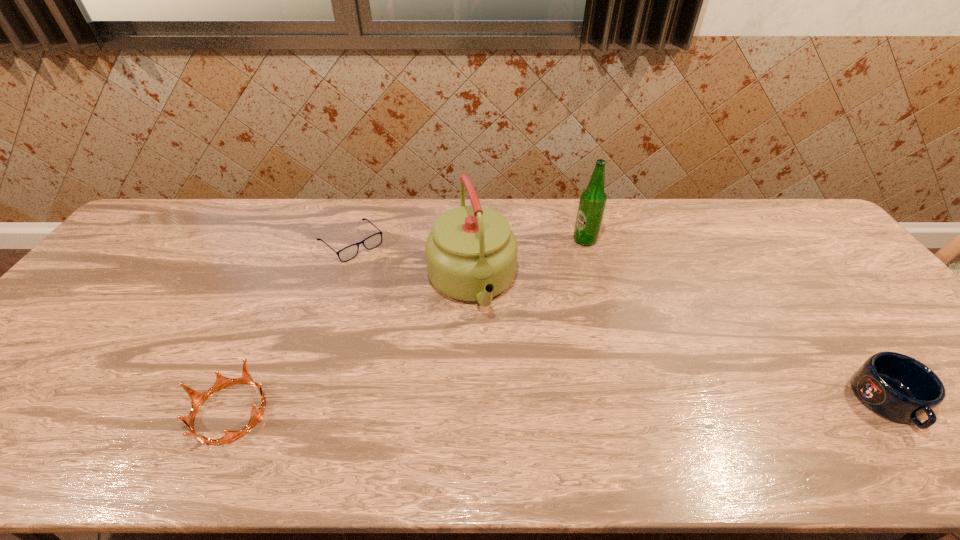
Where is `free spot located on the front-facing side of the shortest object`? free spot located on the front-facing side of the shortest object is located at coordinates pyautogui.click(x=410, y=299).

What are the coordinates of `vacant region located on the front-facing side of the shortest object` in the screenshot? It's located at (392, 282).

The width and height of the screenshot is (960, 540). In order to click on vacant space located on the label of the beer bottle in this screenshot , I will do coord(545,331).

Image resolution: width=960 pixels, height=540 pixels. I want to click on vacant space located on the label of the beer bottle, so click(578, 256).

Locate an element on the screen. The height and width of the screenshot is (540, 960). blank space located on the label of the beer bottle is located at coordinates (564, 286).

You are a GUI agent. You are given a task and a screenshot of the screen. Output one action in this format:
    pyautogui.click(x=<x>, y=<y>)
    Task: Click on the spectacles that is at the far edge
    Image resolution: width=960 pixels, height=540 pixels.
    Given the screenshot: What is the action you would take?
    pyautogui.click(x=373, y=241)

Where is `beer bottle that is positioned at the far edge`? This screenshot has height=540, width=960. beer bottle that is positioned at the far edge is located at coordinates (592, 203).

You are a GUI agent. You are given a task and a screenshot of the screen. Output one action in this format:
    pyautogui.click(x=<x>, y=<y>)
    Task: Click on the crown at the near edge
    
    Given the screenshot: What is the action you would take?
    pyautogui.click(x=198, y=398)

Where is `mug that is at the near edge`? The image size is (960, 540). mug that is at the near edge is located at coordinates (895, 386).

The width and height of the screenshot is (960, 540). What are the coordinates of `object at the right edge` in the screenshot? It's located at (895, 386).